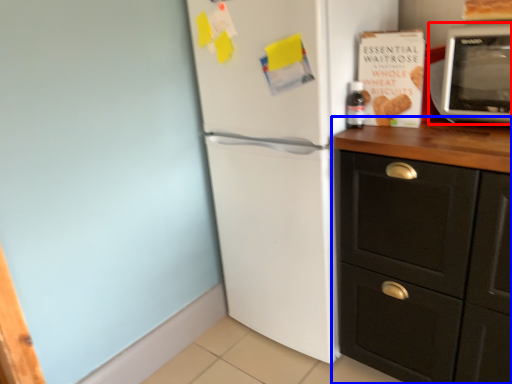
Question: Which object is further to the camera taking this photo, microwave oven (highlighted by a red box) or cabinetry (highlighted by a blue box)?

Choices:
 (A) microwave oven
 (B) cabinetry

Answer: (A)